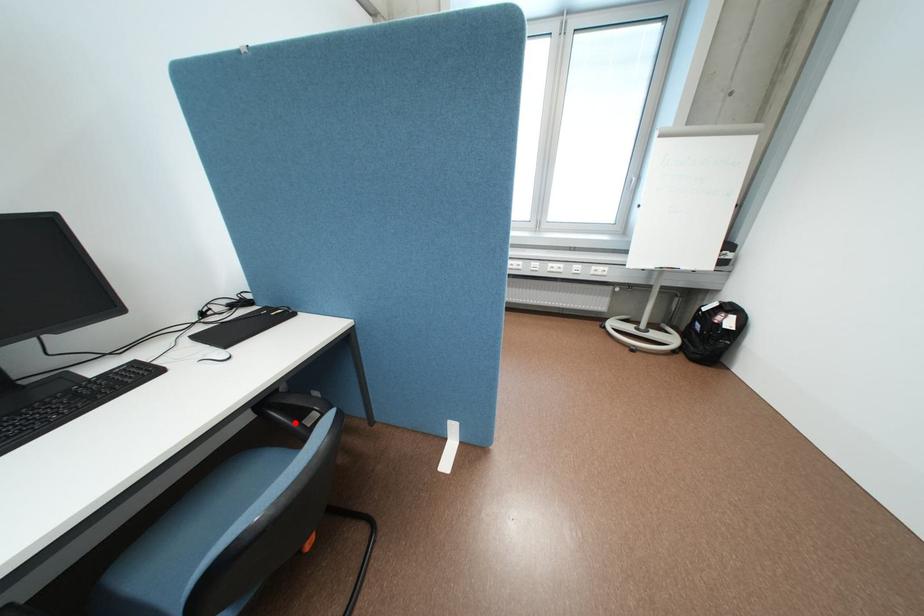
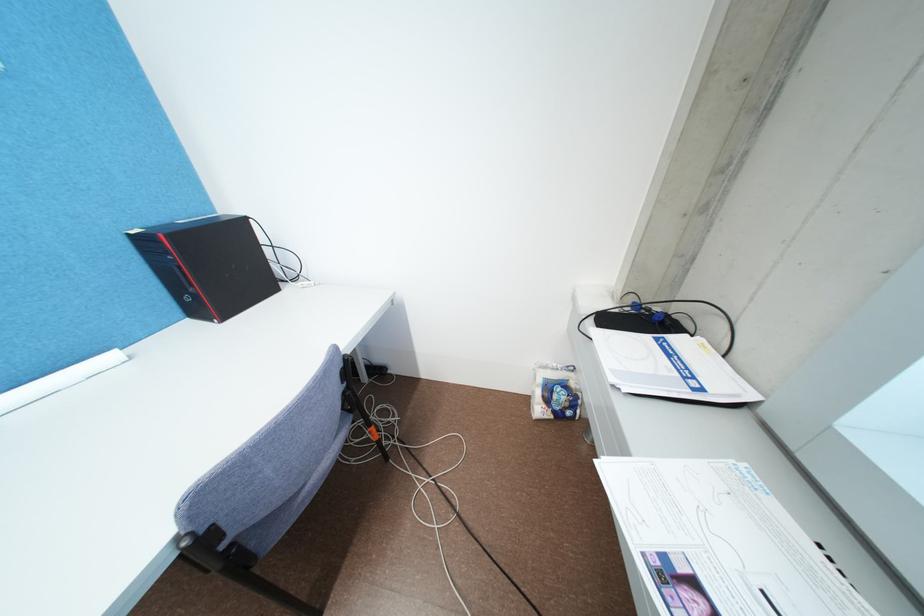
Question: I am providing you with two images of the same scene from different viewpoints. A red point is marked on the first image. At the location where the point appears in image 1, is it still visible in image 2?

Choices:
 (A) Yes
 (B) No

Answer: (B)